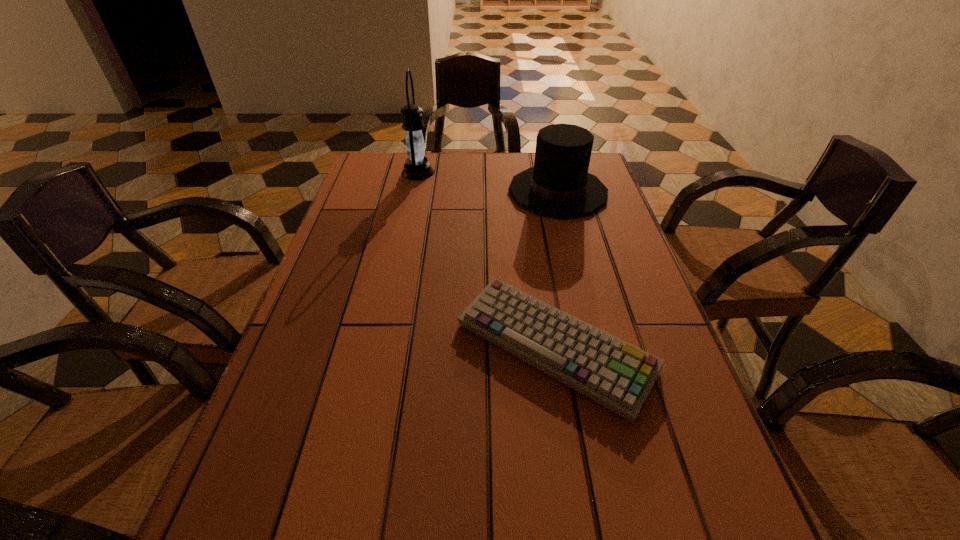
Where is `lantern situated at the far edge`? This screenshot has width=960, height=540. lantern situated at the far edge is located at coordinates (417, 167).

The height and width of the screenshot is (540, 960). I want to click on dress hat located at the far edge, so click(x=559, y=185).

The height and width of the screenshot is (540, 960). In order to click on object that is at the left edge in this screenshot , I will do `click(417, 167)`.

Locate an element on the screen. dress hat positioned at the right edge is located at coordinates point(559,185).

Identify the location of computer keyboard present at the right edge. (615, 374).

You are a GUI agent. You are given a task and a screenshot of the screen. Output one action in this format:
    pyautogui.click(x=<x>, y=<y>)
    Task: Click on the object that is at the far left corner
    
    Given the screenshot: What is the action you would take?
    pyautogui.click(x=417, y=167)

The width and height of the screenshot is (960, 540). I want to click on object located in the far right corner section of the desktop, so click(559, 185).

In the image, there is a desktop. Find the location of `vacant space at the far edge`. vacant space at the far edge is located at coordinates (488, 188).

In the image, there is a desktop. Where is `vacant space at the left edge`? vacant space at the left edge is located at coordinates (332, 309).

In the image, there is a desktop. Where is `vacant region at the right edge`? vacant region at the right edge is located at coordinates (597, 319).